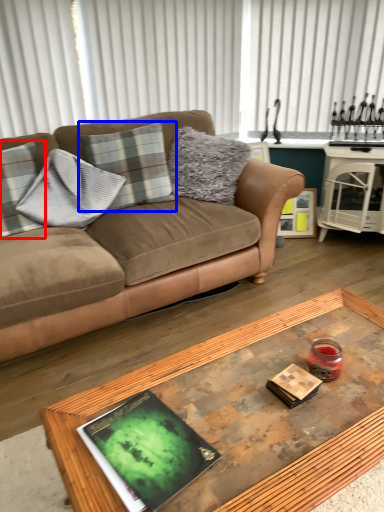
Question: Which of the following is the farthest to the observer, pillow (highlighted by a red box) or pillow (highlighted by a blue box)?

Choices:
 (A) pillow
 (B) pillow

Answer: (B)